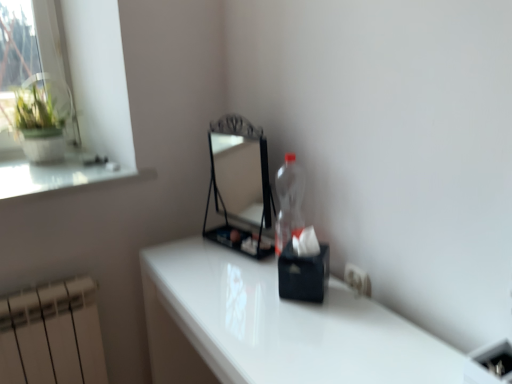
Locate an element on the screen. The height and width of the screenshot is (384, 512). free point below metallic black mirror at center (from a real-world perspective) is located at coordinates (252, 240).